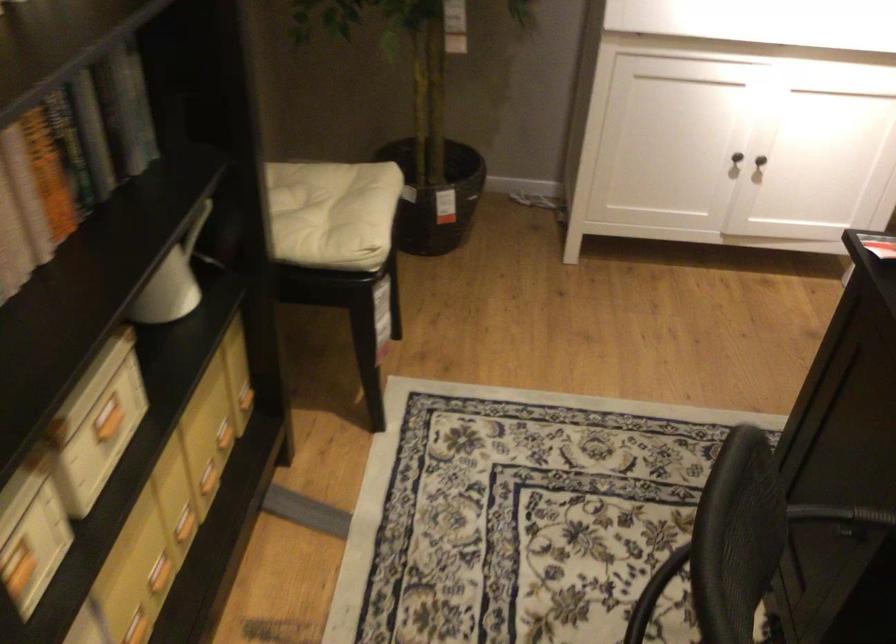
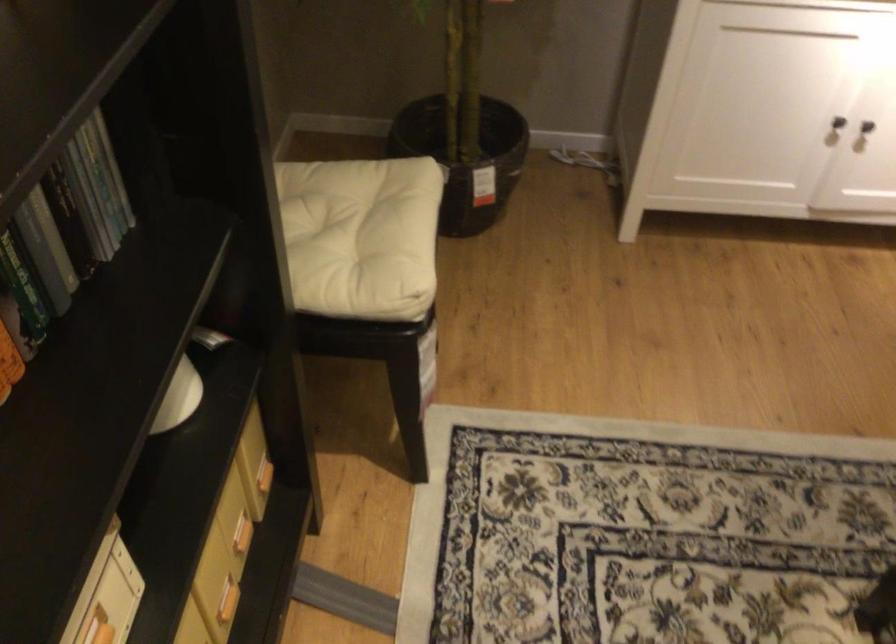
The point at (101, 149) is marked in the first image. Where is the corresponding point in the second image?

(53, 238)